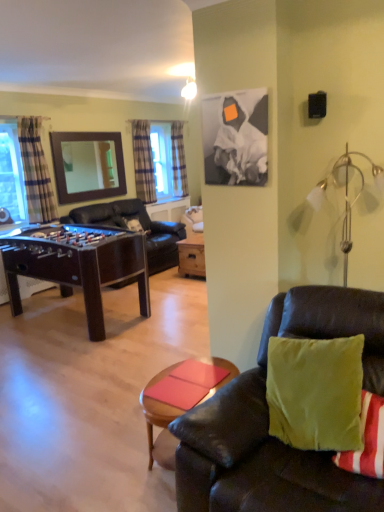
In order to face smooth wooden coffee table at lower center, should I rotate leftwards or rightwards?

To face it directly, rotate right by 0.104 degrees.

Measure the distance between smooth wooden coffee table at lower center and camera.

They are 1.93 meters apart.

What is the approximate width of plaid fabric curtain at center, the second curtain in the left-to-right sequence?

7.11 inches.

You are a GUI agent. You are given a task and a screenshot of the screen. Output one action in this format:
    pyautogui.click(x=<x>, y=<y>)
    Task: Click on the velvet green couch at lower right, the 1th studio couch from the right
    The height and width of the screenshot is (512, 384).
    Given the screenshot: What is the action you would take?
    pyautogui.click(x=268, y=421)

This screenshot has width=384, height=512. What do you see at coordinates (77, 265) in the screenshot?
I see `mahogany wood foosball table at left` at bounding box center [77, 265].

This screenshot has height=512, width=384. I want to click on wooden mirror at upper left, so click(88, 165).

Where is `smooth wooden coffee table at lower center`? The width and height of the screenshot is (384, 512). smooth wooden coffee table at lower center is located at coordinates (160, 423).

Is green fabric pillow at lower right not close to plaid fabric curtain at upper left, the first curtain in the back-to-front sequence?

Indeed, green fabric pillow at lower right is not near plaid fabric curtain at upper left, the first curtain in the back-to-front sequence.

Is point (350, 456) less distant than point (183, 177)?

Yes, point (350, 456) is in front of point (183, 177).

Can you confirm if green fabric pillow at lower right is shorter than plaid fabric curtain at upper left, the first curtain in the back-to-front sequence?

Indeed, green fabric pillow at lower right has a lesser height compared to plaid fabric curtain at upper left, the first curtain in the back-to-front sequence.

Is green fabric pillow at lower right in front of plaid fabric curtain at upper left, which is the 1th curtain from right to left?

Yes, it is.

This screenshot has width=384, height=512. Identify the location of the 2nd curtain counting from the left side of the velvet green couch at lower right, the first studio couch in the front-to-back sequence. (143, 161).

Is velvet green couch at lower right, the first studio couch in the front-to-back sequence, outside of plaid fabric curtain at center, the second curtain viewed from the right?

velvet green couch at lower right, the first studio couch in the front-to-back sequence, is positioned outside plaid fabric curtain at center, the second curtain viewed from the right.

Looking at their sizes, would you say velvet green couch at lower right, which is counted as the first studio couch, starting from the bottom, is wider or thinner than plaid fabric curtain at center, the second curtain viewed from the right?

Clearly, velvet green couch at lower right, which is counted as the first studio couch, starting from the bottom, has more width compared to plaid fabric curtain at center, the second curtain viewed from the right.

Which is in front, velvet green couch at lower right, which is counted as the first studio couch, starting from the bottom, or plaid fabric curtain at center, the second curtain in the left-to-right sequence?

velvet green couch at lower right, which is counted as the first studio couch, starting from the bottom, is closer to the camera.

From a real-world perspective, which is physically above, dark brown leather couch at center, placed as the first studio couch when sorted from left to right, or wooden mirror at upper left?

wooden mirror at upper left.

Considering the sizes of objects dark brown leather couch at center, the 2th studio couch positioned from the bottom, and wooden mirror at upper left in the image provided, who is taller, dark brown leather couch at center, the 2th studio couch positioned from the bottom, or wooden mirror at upper left?

dark brown leather couch at center, the 2th studio couch positioned from the bottom, is taller.

From the picture: From the image's perspective, relative to wooden mirror at upper left, is dark brown leather couch at center, placed as the first studio couch when sorted from left to right, above or below?

dark brown leather couch at center, placed as the first studio couch when sorted from left to right, is situated lower than wooden mirror at upper left in the image.

Between point (129, 282) and point (115, 169), which one is positioned behind?

Positioned behind is point (115, 169).

In the image, is white glass lamp at upper right on the left side or the right side of wooden mirror at upper left?

Clearly, white glass lamp at upper right is on the right of wooden mirror at upper left in the image.

Is white glass lamp at upper right positioned with its back to wooden mirror at upper left?

white glass lamp at upper right is not turned away from wooden mirror at upper left.

In terms of height, does white glass lamp at upper right look taller or shorter compared to wooden mirror at upper left?

Clearly, white glass lamp at upper right is shorter compared to wooden mirror at upper left.

Which object is thinner, white glass lamp at upper right or wooden mirror at upper left?

wooden mirror at upper left.

Which of these two, velvet green couch at lower right, the second studio couch when ordered from top to bottom, or smooth wooden coffee table at lower center, stands shorter?

Standing shorter between the two is smooth wooden coffee table at lower center.

Are velvet green couch at lower right, the first studio couch in the front-to-back sequence, and smooth wooden coffee table at lower center far apart?

Actually, velvet green couch at lower right, the first studio couch in the front-to-back sequence, and smooth wooden coffee table at lower center are a little close together.

Relative to smooth wooden coffee table at lower center, is velvet green couch at lower right, the second studio couch when ordered from top to bottom, in front or behind?

Visually, velvet green couch at lower right, the second studio couch when ordered from top to bottom, is located in front of smooth wooden coffee table at lower center.

Does velvet green couch at lower right, the second studio couch when ordered from top to bottom, appear on the left side of smooth wooden coffee table at lower center?

Incorrect, velvet green couch at lower right, the second studio couch when ordered from top to bottom, is not on the left side of smooth wooden coffee table at lower center.

Is plaid fabric curtain at upper left, the third curtain from the left, not inside green fabric pillow at lower right?

plaid fabric curtain at upper left, the third curtain from the left, lies outside green fabric pillow at lower right's area.

How different are the orientations of plaid fabric curtain at upper left, which is the 1th curtain from right to left, and green fabric pillow at lower right in degrees?

91.1 degrees.

Who is taller, plaid fabric curtain at upper left, the first curtain in the back-to-front sequence, or green fabric pillow at lower right?

Standing taller between the two is plaid fabric curtain at upper left, the first curtain in the back-to-front sequence.

How far apart are plaid fabric curtain at upper left, which is counted as the 3th curtain, starting from the front, and green fabric pillow at lower right?

plaid fabric curtain at upper left, which is counted as the 3th curtain, starting from the front, and green fabric pillow at lower right are 6.00 meters apart from each other.

Based on the photo, is dark brown leather couch at center, placed as the first studio couch when sorted from left to right, far away from clear glass window at left?

Yes, dark brown leather couch at center, placed as the first studio couch when sorted from left to right, and clear glass window at left are quite far apart.

Does dark brown leather couch at center, acting as the 2th studio couch starting from the right, come in front of clear glass window at left?

No.

Considering the relative positions of dark brown leather couch at center, the 2th studio couch positioned from the bottom, and clear glass window at left in the image provided, is dark brown leather couch at center, the 2th studio couch positioned from the bottom, to the right of clear glass window at left from the viewer's perspective?

Correct, you'll find dark brown leather couch at center, the 2th studio couch positioned from the bottom, to the right of clear glass window at left.

From the image's perspective, starting from the green fabric pillow at lower right, which curtain is the 3rd one above? Please provide its 2D coordinates.

[(178, 159)]

Locate an element on the screen. The image size is (384, 512). the 2nd studio couch below the plaid fabric curtain at center, the second curtain in the left-to-right sequence (from the image's perspective) is located at coordinates (268, 421).

Based on their spatial positions, is plaid fabric curtain at center, marked as the second curtain in a front-to-back arrangement, or dark brown leather couch at center, acting as the 2th studio couch starting from the right, further from white glass lamp at upper right?

The object further to white glass lamp at upper right is plaid fabric curtain at center, marked as the second curtain in a front-to-back arrangement.

Looking at the image, which one is located closer to smooth wooden coffee table at lower center, wooden mirror at upper left or velvet green couch at lower right, the 2th studio couch positioned from the left?

velvet green couch at lower right, the 2th studio couch positioned from the left, lies closer to smooth wooden coffee table at lower center than the other object.

Estimate the real-world distances between objects in this image. Which object is closer to dark brown leather couch at center, placed as the first studio couch when sorted from left to right, white glass lamp at upper right or plaid fabric curtain at center, the second curtain viewed from the right?

plaid fabric curtain at center, the second curtain viewed from the right.

Looking at the image, which one is located closer to white glass lamp at upper right, velvet green couch at lower right, the 1th studio couch from the right, or mahogany wood foosball table at left?

Among the two, velvet green couch at lower right, the 1th studio couch from the right, is located nearer to white glass lamp at upper right.

In the scene shown: Estimate the real-world distances between objects in this image. Which object is closer to plaid fabric curtain at center, positioned as the 2th curtain in back-to-front order, plaid fabric curtain at left, placed as the first curtain when sorted from left to right, or plaid fabric curtain at upper left, which is counted as the 3th curtain, starting from the front?

plaid fabric curtain at upper left, which is counted as the 3th curtain, starting from the front.

Based on their spatial positions, is white glass lamp at upper right or wooden mirror at upper left closer to plaid fabric curtain at left, which is counted as the 3th curtain, starting from the right?

Based on the image, wooden mirror at upper left appears to be nearer to plaid fabric curtain at left, which is counted as the 3th curtain, starting from the right.

Considering their positions, is smooth wooden coffee table at lower center positioned closer to green fabric pillow at lower right than white glass lamp at upper right?

smooth wooden coffee table at lower center is closer to green fabric pillow at lower right.

Looking at the image, which one is located further to velvet green couch at lower right, the second studio couch when ordered from top to bottom, clear glass window at left or plaid fabric curtain at left, placed as the first curtain when sorted from left to right?

Based on the image, clear glass window at left appears to be further to velvet green couch at lower right, the second studio couch when ordered from top to bottom.

Where is `mirror between green fabric pillow at lower right and plaid fabric curtain at upper left, which is the 1th curtain from right to left, from front to back`? The height and width of the screenshot is (512, 384). mirror between green fabric pillow at lower right and plaid fabric curtain at upper left, which is the 1th curtain from right to left, from front to back is located at coordinates (88, 165).

I want to click on window screen between velvet green couch at lower right, which is counted as the second studio couch, starting from the back, and dark brown leather couch at center, acting as the 1th studio couch starting from the back, in the front-back direction, so [x=12, y=173].

Where is `window screen between green fabric pillow at lower right and plaid fabric curtain at upper left, which is the 1th curtain from right to left, in the front-back direction`? The width and height of the screenshot is (384, 512). window screen between green fabric pillow at lower right and plaid fabric curtain at upper left, which is the 1th curtain from right to left, in the front-back direction is located at coordinates (12, 173).

I want to click on window screen between smooth wooden coffee table at lower center and wooden mirror at upper left in the front-back direction, so click(12, 173).